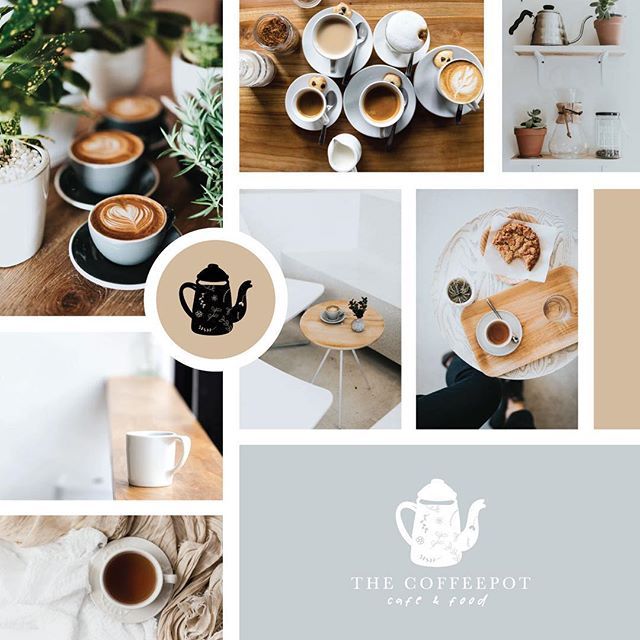
The height and width of the screenshot is (640, 640). In order to click on wooden surfaces in this screenshot , I will do `click(262, 136)`, `click(52, 278)`, `click(148, 404)`, `click(337, 333)`.